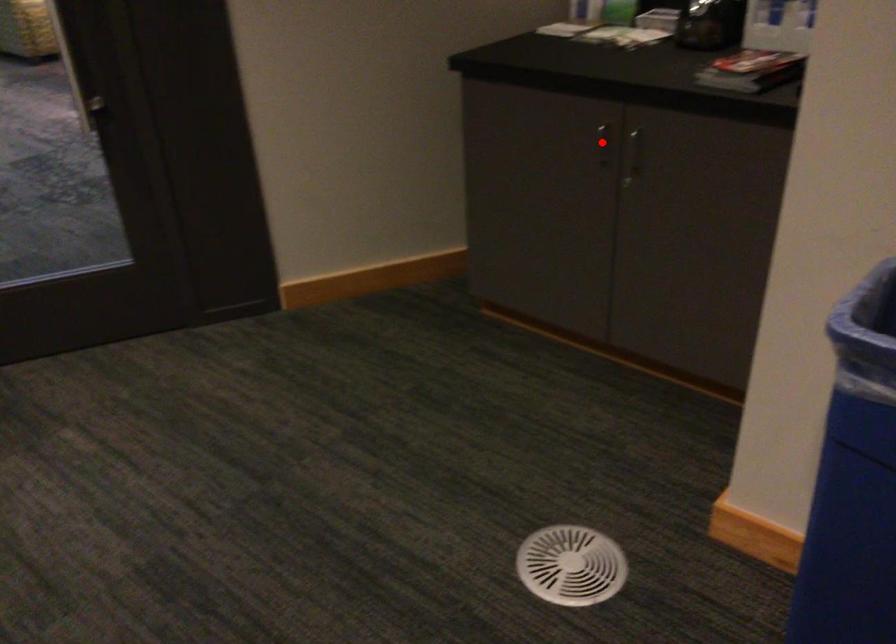
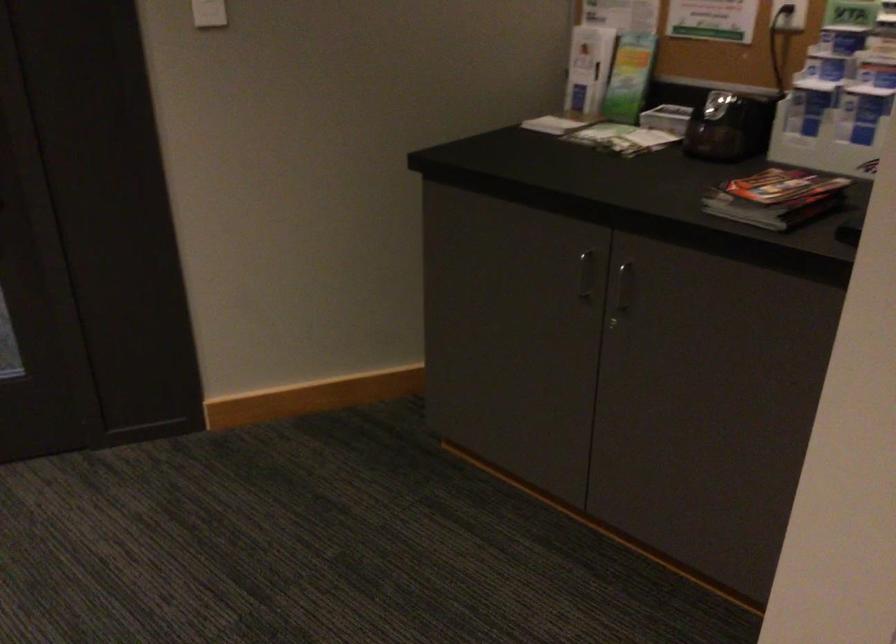
Question: A red point is marked in image1. In image2, is the corresponding 3D point closer to the camera or farther? Reply with the corresponding letter.

Choices:
 (A) The corresponding 3D point is closer.
 (B) The corresponding 3D point is farther.

Answer: (A)